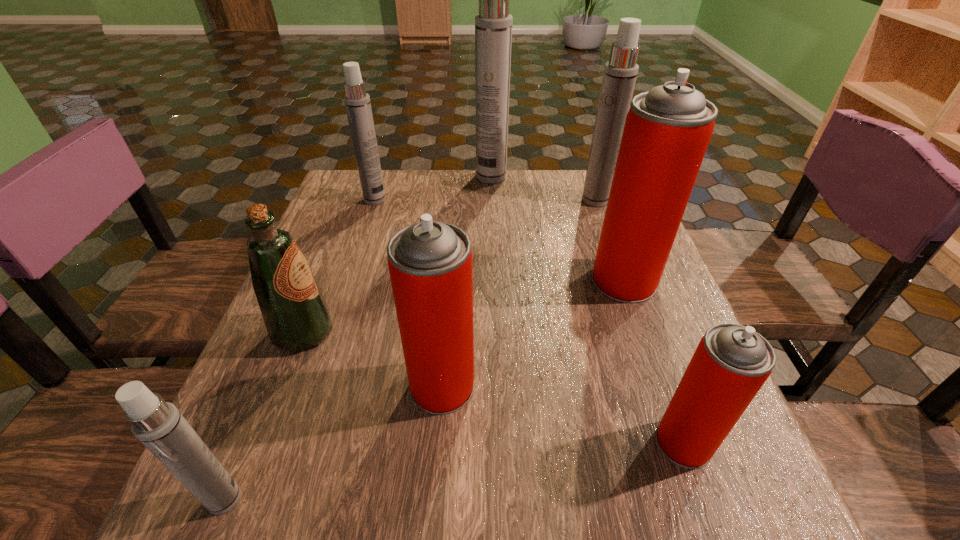
You are a GUI agent. You are given a task and a screenshot of the screen. Output one action in this format:
    pyautogui.click(x=<x>, y=<y>)
    Task: Click on the vacant space at the left edge of the desktop
    
    Given the screenshot: What is the action you would take?
    pyautogui.click(x=324, y=273)

What are the coordinates of `vacant space at the right edge` in the screenshot? It's located at (660, 367).

Find the location of `free space at the far right corner`. free space at the far right corner is located at coordinates (567, 182).

In order to click on free space that is in between the nearest aerosol can and the farthest aerosol can in this screenshot , I will do `click(358, 338)`.

Identify the location of free space between the farthest aerosol can and the rightmost white aerosol can. (543, 188).

Locate an element on the screen. The image size is (960, 540). free space between the sixth farthest object and the nearest white aerosol can is located at coordinates (333, 442).

Where is `free point between the green olive oil and the nearest white aerosol can`? This screenshot has height=540, width=960. free point between the green olive oil and the nearest white aerosol can is located at coordinates (264, 415).

Image resolution: width=960 pixels, height=540 pixels. Identify the location of vacant space that is in between the second aerosol can from left to right and the fourth farthest aerosol can. (499, 240).

I want to click on free area in between the nearest object and the nearest red aerosol can, so click(x=454, y=470).

Find the location of a particular element. unoccupied position between the olive oil and the second biggest red aerosol can is located at coordinates (372, 359).